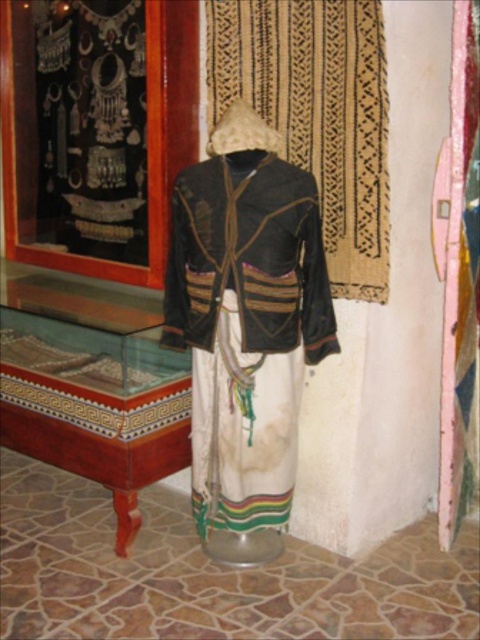
You are a visitor in the museum and want to place a small souvenir on the transparent glass table at lower left. What are the coordinates where you should place it?

The coordinates for the transparent glass table at lower left are at point (92, 385).

You are a visitor in the museum and want to place a small brochure on the transparent glass table at lower left. Can you confirm the exact coordinates where the table is located?

The transparent glass table at lower left is located at point (92,385), so you can place the brochure there accurately.